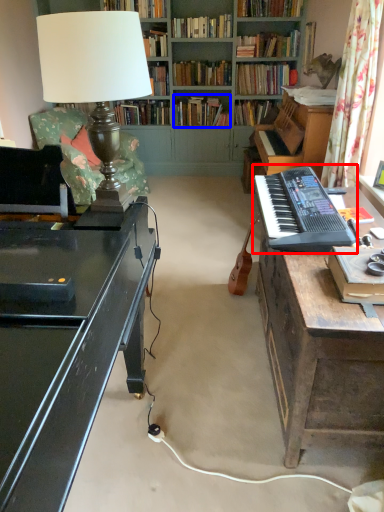
Question: Which of the following is the closest to the observer, musical keyboard (highlighted by a red box) or book (highlighted by a blue box)?

Choices:
 (A) musical keyboard
 (B) book

Answer: (A)